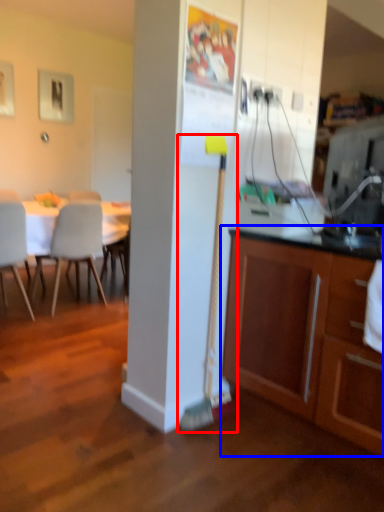
Question: Which point is further to the camera, brush (highlighted by a red box) or cabinetry (highlighted by a blue box)?

Choices:
 (A) brush
 (B) cabinetry

Answer: (A)